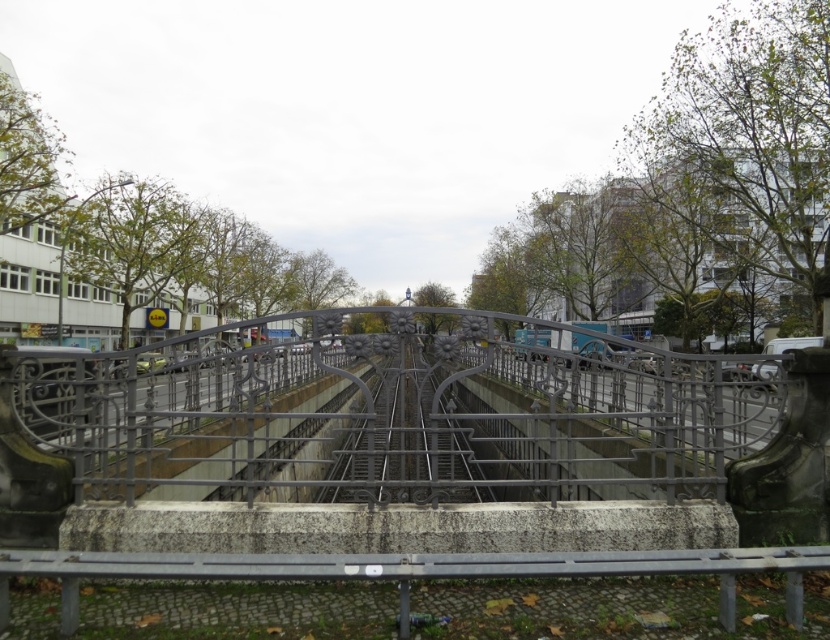
Is point (334, 464) positioned before point (536, 330)?

Yes.

In the scene shown: Is polished metal fence at center smaller than metallic silver train at center?

Actually, polished metal fence at center might be larger than metallic silver train at center.

The image size is (830, 640). Describe the element at coordinates (394, 413) in the screenshot. I see `polished metal fence at center` at that location.

This screenshot has height=640, width=830. I want to click on polished metal fence at center, so click(394, 413).